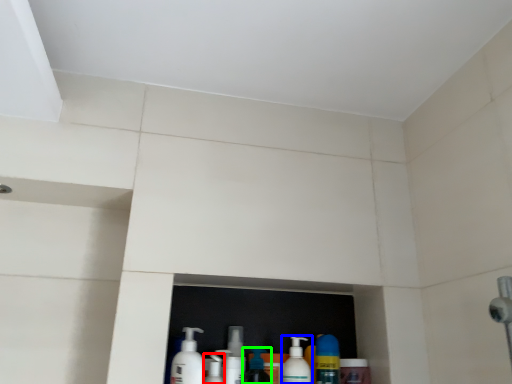
Question: Estimate the real-world distances between objects in this image. Which object is farther from cleaning product (highlighted by a red box), cleaning product (highlighted by a blue box) or cleaning product (highlighted by a green box)?

Choices:
 (A) cleaning product
 (B) cleaning product

Answer: (A)